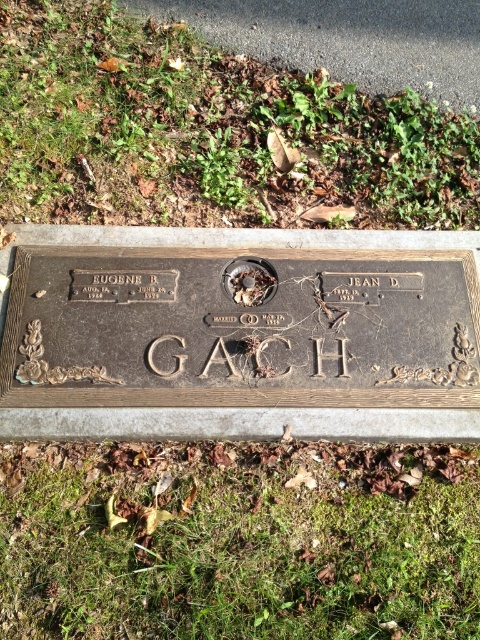
Question: Is bronze plaque at center behind rusty metal ring at center?

Choices:
 (A) no
 (B) yes

Answer: (A)

Question: Is the position of green grass at upper center less distant than that of rusty metal ring at center?

Choices:
 (A) yes
 (B) no

Answer: (B)

Question: Does green grass at upper center have a larger size compared to bronze plaque at center?

Choices:
 (A) no
 (B) yes

Answer: (B)

Question: Which object is closer to the camera taking this photo?

Choices:
 (A) green grass at lower center
 (B) green grass at upper center
 (C) bronze plaque at center

Answer: (A)

Question: Which point is farther from the camera taking this photo?

Choices:
 (A) (84, 253)
 (B) (379, 179)
 (C) (251, 296)
 (D) (425, 451)

Answer: (B)

Question: Among these points, which one is farthest from the camera?

Choices:
 (A) (153, 58)
 (B) (20, 547)
 (C) (201, 381)
 (D) (273, 268)

Answer: (A)